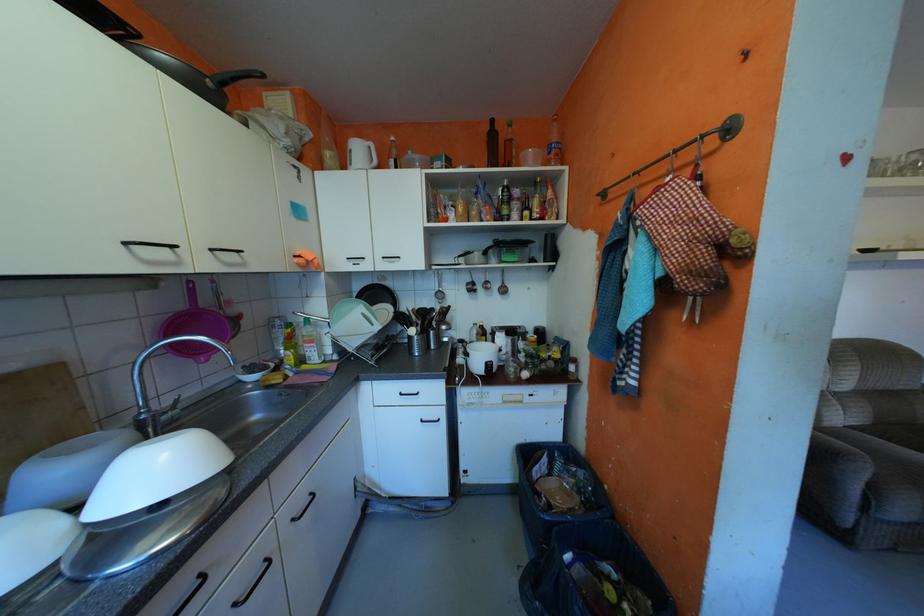
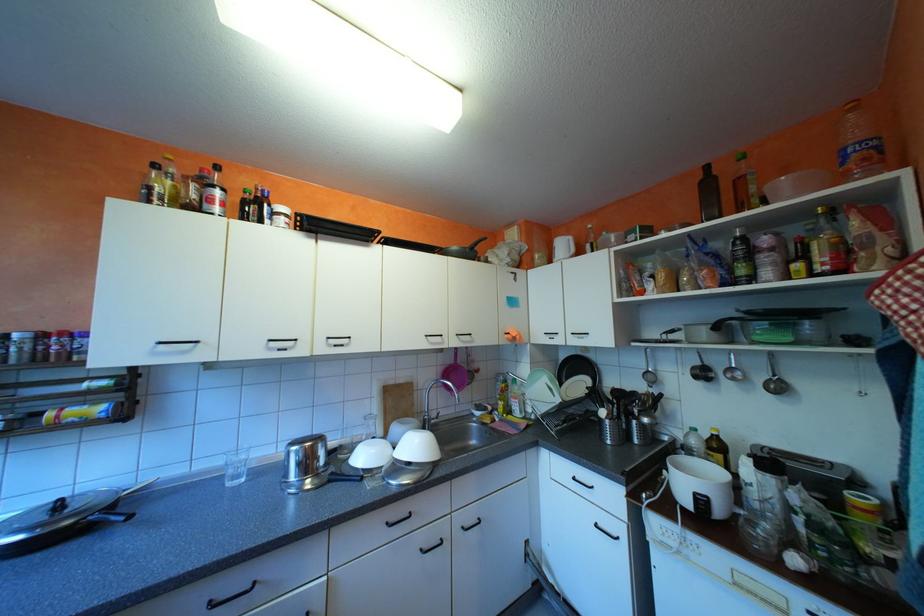
Where in the second image is the point corresponding to [507,285] from the first image?

(772, 377)